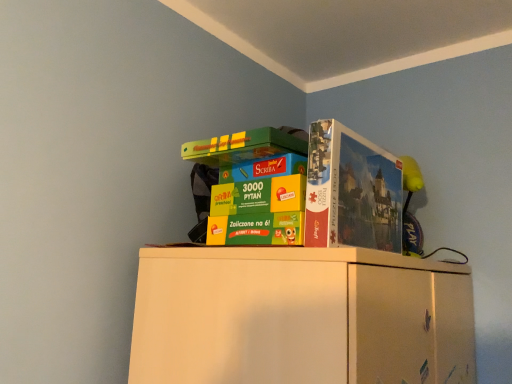
Question: Is multicolored cardboard boxes at upper center inside matte cardboard puzzle box at upper right?

Choices:
 (A) no
 (B) yes

Answer: (A)

Question: Is matte cardboard puzzle box at upper right facing towards multicolored cardboard boxes at upper center?

Choices:
 (A) no
 (B) yes

Answer: (B)

Question: Considering the relative positions of matte cardboard puzzle box at upper right and multicolored cardboard boxes at upper center in the image provided, is matte cardboard puzzle box at upper right to the right of multicolored cardboard boxes at upper center from the viewer's perspective?

Choices:
 (A) yes
 (B) no

Answer: (A)

Question: Is matte cardboard puzzle box at upper right located outside multicolored cardboard boxes at upper center?

Choices:
 (A) yes
 (B) no

Answer: (A)

Question: From the image's perspective, is matte cardboard puzzle box at upper right above multicolored cardboard boxes at upper center?

Choices:
 (A) yes
 (B) no

Answer: (A)

Question: Is matte cardboard puzzle box at upper right not close to multicolored cardboard boxes at upper center?

Choices:
 (A) yes
 (B) no

Answer: (B)

Question: From the image's perspective, does multicolored cardboard boxes at upper center appear higher than matte cardboard puzzle box at upper right?

Choices:
 (A) yes
 (B) no

Answer: (B)

Question: Is multicolored cardboard boxes at upper center further to camera compared to matte cardboard puzzle box at upper right?

Choices:
 (A) no
 (B) yes

Answer: (A)

Question: Is multicolored cardboard boxes at upper center oriented away from matte cardboard puzzle box at upper right?

Choices:
 (A) no
 (B) yes

Answer: (B)

Question: Does multicolored cardboard boxes at upper center come in front of matte cardboard puzzle box at upper right?

Choices:
 (A) yes
 (B) no

Answer: (A)

Question: Is multicolored cardboard boxes at upper center positioned beyond the bounds of matte cardboard puzzle box at upper right?

Choices:
 (A) yes
 (B) no

Answer: (A)

Question: Does multicolored cardboard boxes at upper center turn towards matte cardboard puzzle box at upper right?

Choices:
 (A) yes
 (B) no

Answer: (A)

Question: From the image's perspective, is matte cardboard puzzle box at upper right located above or below multicolored cardboard boxes at upper center?

Choices:
 (A) below
 (B) above

Answer: (B)